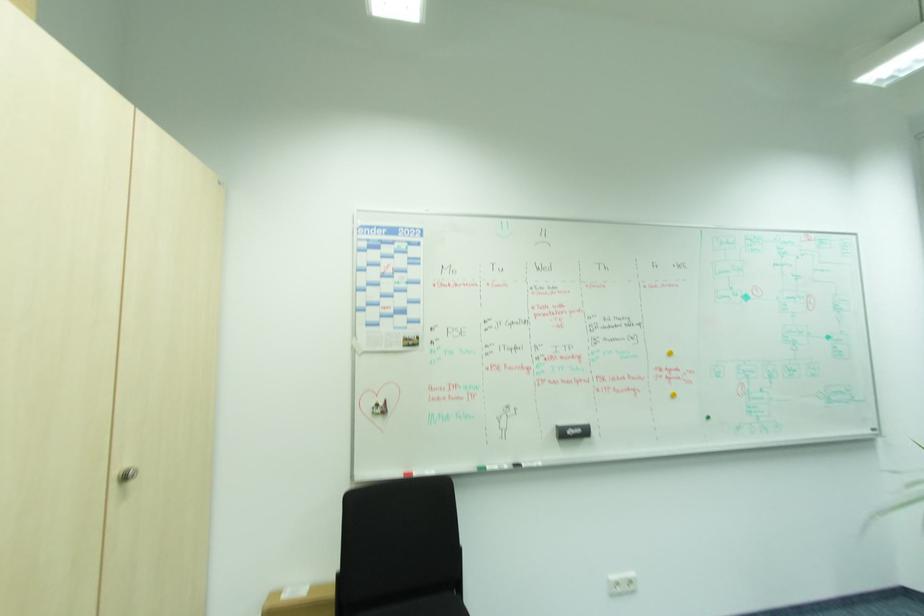
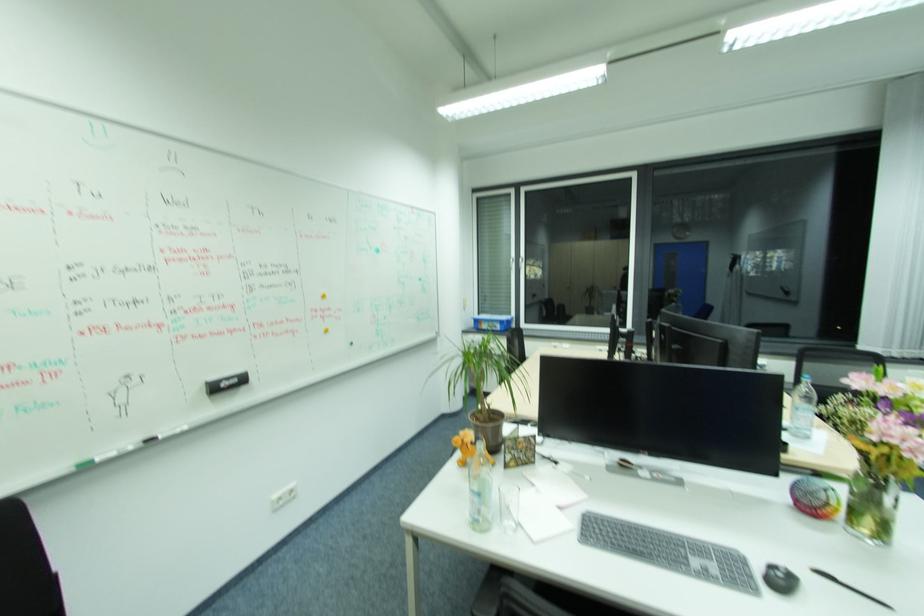
The point at (584, 430) is marked in the first image. Where is the corresponding point in the second image?

(240, 381)